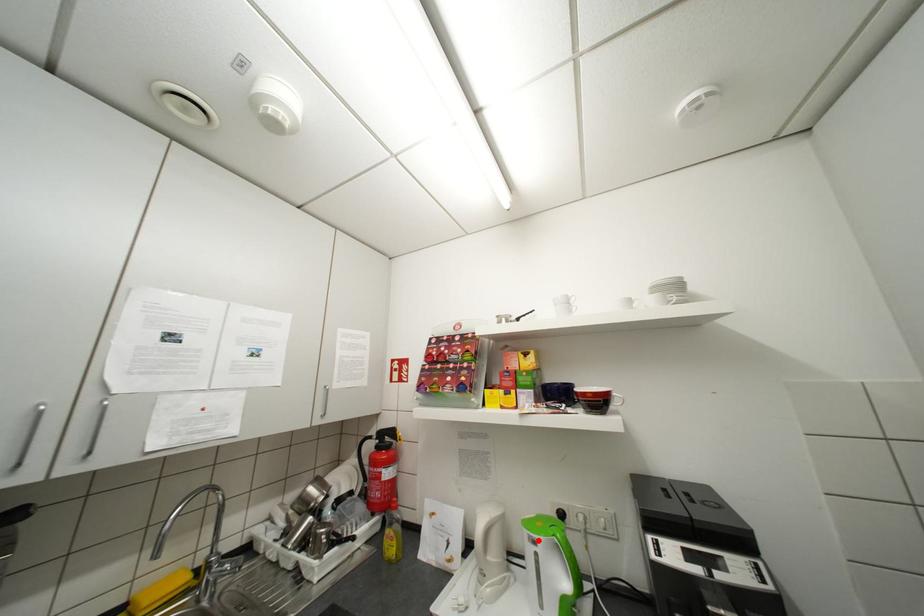
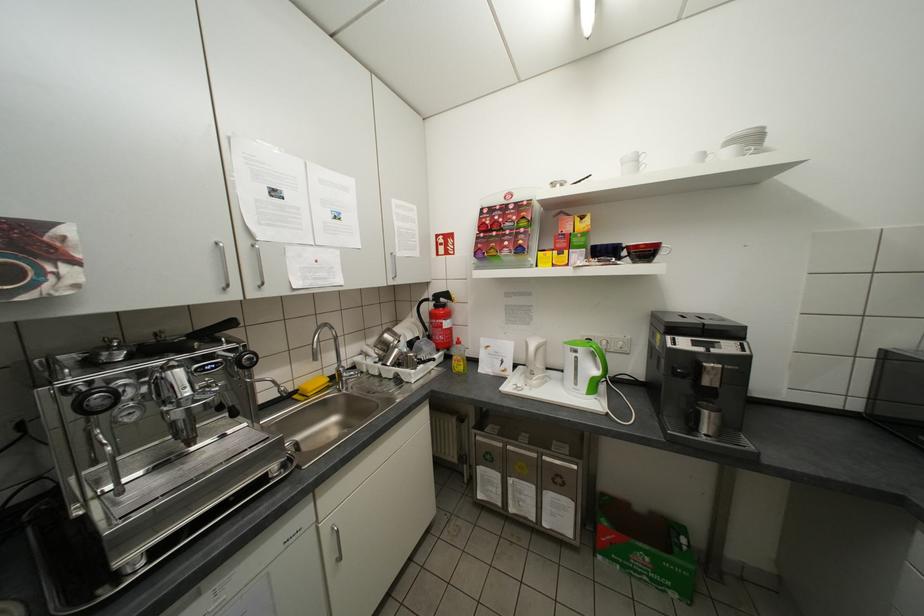
Question: I am providing you with two images of the same scene from different viewpoints. A red point is marked on the first image. Is the red point's position out of view in image 2?

Choices:
 (A) Yes
 (B) No

Answer: (B)